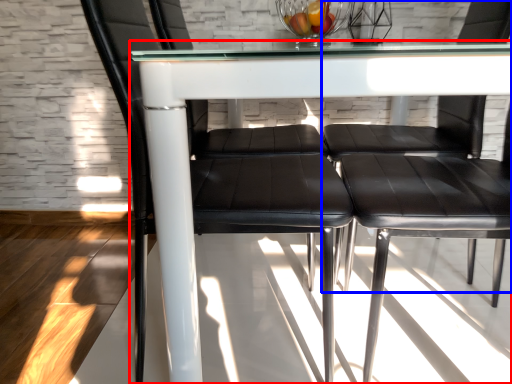
Question: Which point is closer to the camera, table (highlighted by a red box) or chair (highlighted by a blue box)?

Choices:
 (A) table
 (B) chair

Answer: (A)